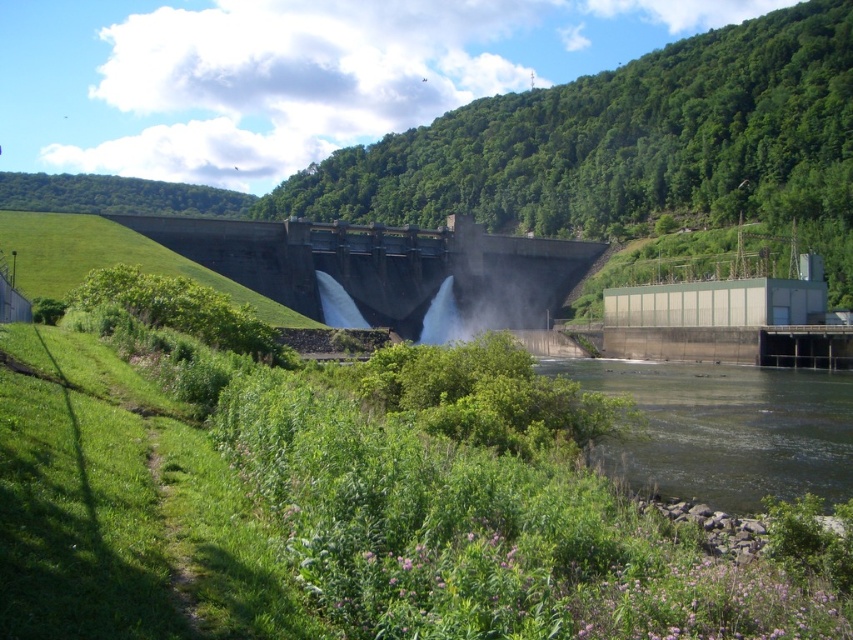
From the picture: Does greenish-gray concrete waterway at lower right have a lesser width compared to gray concrete dam at center?

Indeed, greenish-gray concrete waterway at lower right has a lesser width compared to gray concrete dam at center.

Between greenish-gray concrete waterway at lower right and gray concrete dam at center, which one has more height?

gray concrete dam at center is taller.

Describe the element at coordinates (724, 429) in the screenshot. I see `greenish-gray concrete waterway at lower right` at that location.

Identify the location of greenish-gray concrete waterway at lower right. (724, 429).